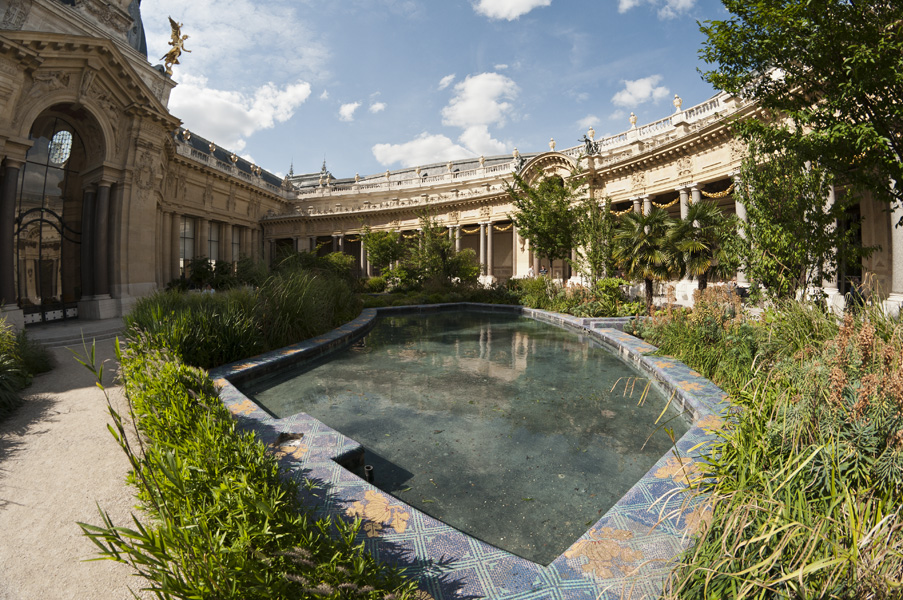
At what (x,y) coordinates should I click in order to perform the action: click on door. Please return your answer as a coordinate pair (x, y). Image resolution: width=903 pixels, height=600 pixels. Looking at the image, I should click on (51, 285).